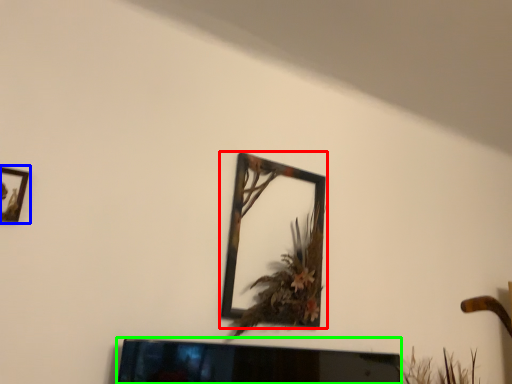
Question: Based on their relative distances, which object is nearer to picture frame (highlighted by a red box)? Choose from picture frame (highlighted by a blue box) and television (highlighted by a green box).

Choices:
 (A) picture frame
 (B) television

Answer: (B)